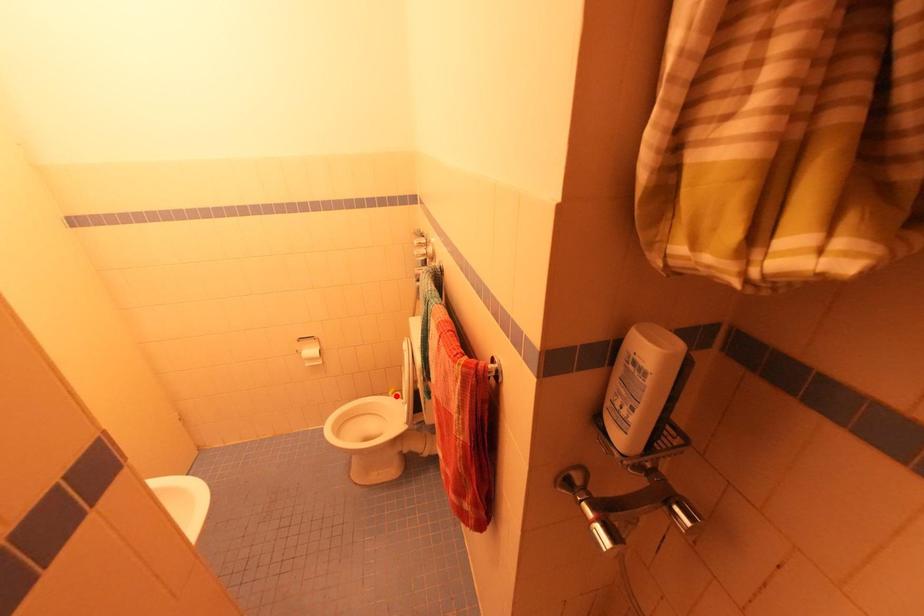
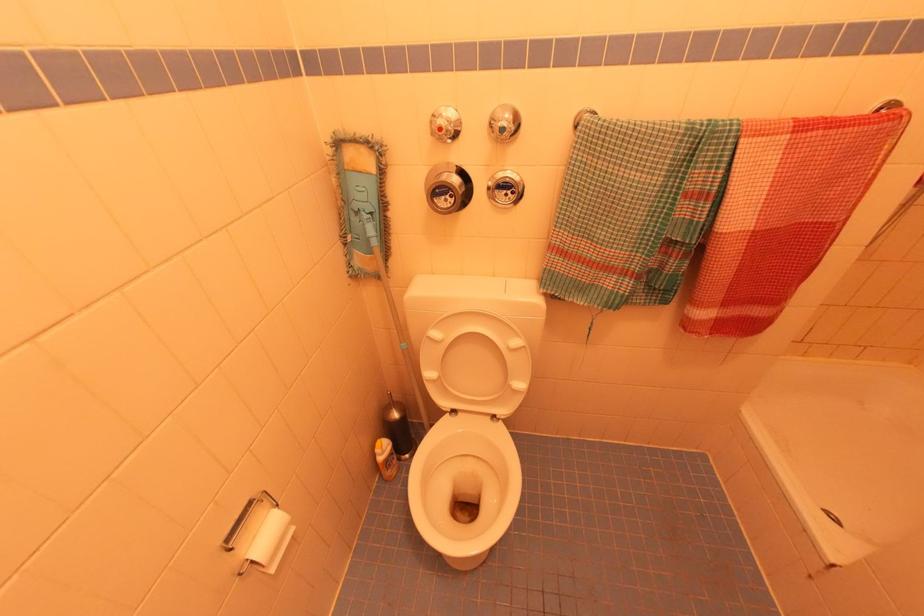
Question: I am providing you with two images of the same scene from different viewpoints. Given a red point in image1, look at the same physical point in image2. Is it:

Choices:
 (A) Closer to the viewpoint
 (B) Farther from the viewpoint

Answer: (A)